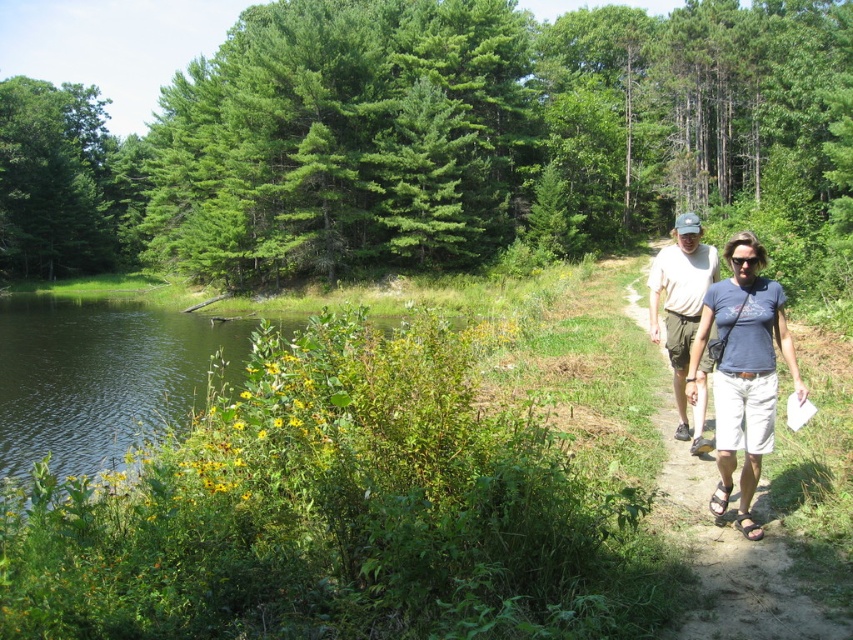
Question: Which of the following is the farthest from the observer?

Choices:
 (A) (35, 298)
 (B) (674, 333)
 (C) (743, 262)

Answer: (A)

Question: Which of the following is the farthest from the observer?

Choices:
 (A) green leafy water at lower left
 (B) blue cotton shirt at right

Answer: (A)

Question: Among these objects, which one is farthest from the camera?

Choices:
 (A) blue cotton shirt at right
 (B) green leafy water at lower left
 (C) light brown shorts at right

Answer: (B)

Question: Observing the image, what is the correct spatial positioning of green leafy water at lower left in reference to blue cotton shirt at right?

Choices:
 (A) left
 (B) right

Answer: (A)

Question: Is green leafy water at lower left closer to the viewer compared to blue cotton shirt at right?

Choices:
 (A) yes
 (B) no

Answer: (B)

Question: Is the position of blue cotton shirt at right more distant than that of light brown shorts at right?

Choices:
 (A) no
 (B) yes

Answer: (A)